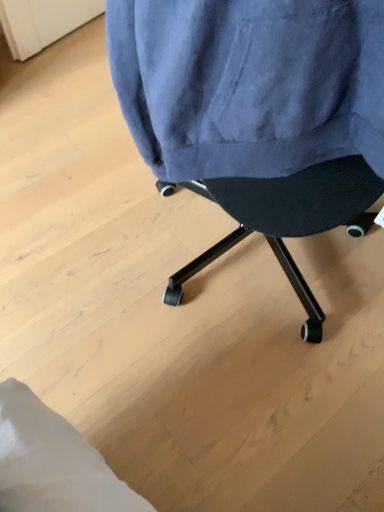
The image size is (384, 512). I want to click on vacant area to the left of suede-like blue chair at center, so click(x=73, y=210).